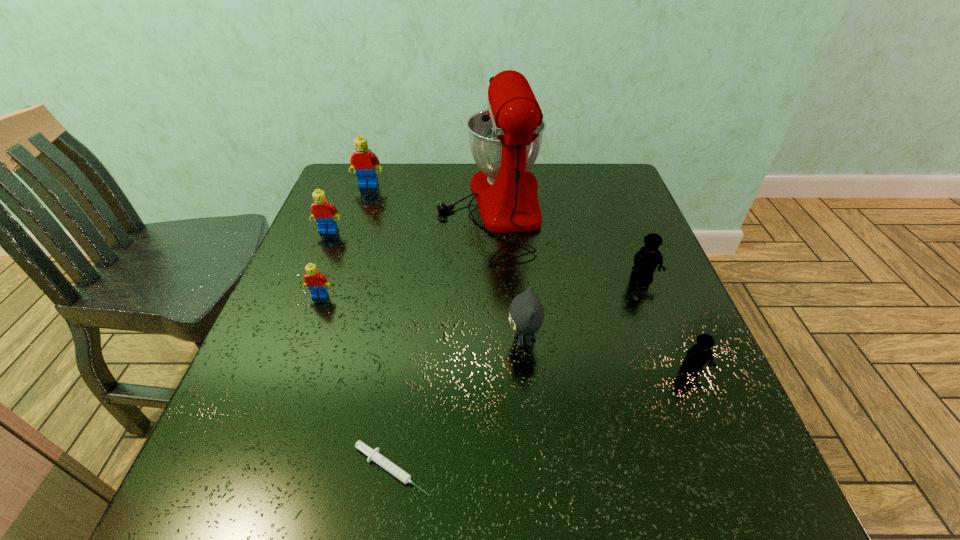
Find the location of `free space between the second biggest red Lego and the fifth nearest object`. free space between the second biggest red Lego and the fifth nearest object is located at coordinates (485, 254).

Locate an element on the screen. The image size is (960, 540). free space that is in between the smaller yellow Lego and the second nearest red Lego is located at coordinates (511, 300).

This screenshot has height=540, width=960. I want to click on vacant space in between the second farthest Lego and the gray kitten, so click(426, 285).

Identify the location of vacant region between the nearer yellow Lego and the biggest red Lego. (530, 277).

Find the location of a particular element. vacant region between the second nearest red Lego and the syringe is located at coordinates (360, 350).

Identify the location of object that ranks as the closest to the syringe. Image resolution: width=960 pixels, height=540 pixels. (526, 313).

Find the location of `object that is the second closest to the smallest red Lego`. object that is the second closest to the smallest red Lego is located at coordinates coord(505,139).

Where is `the second closest Lego to the second smallest red Lego`? The image size is (960, 540). the second closest Lego to the second smallest red Lego is located at coordinates (316, 282).

Choose which Lego is the fourth nearest neighbor to the second farthest red Lego. Please provide its 2D coordinates. Your answer should be formatted as a tuple, i.e. [(x, y)], where the tuple contains the x and y coordinates of a point satisfying the conditions above.

[(700, 353)]

Where is `red Lego object that ranks as the second closest to the fourth farthest Lego`? red Lego object that ranks as the second closest to the fourth farthest Lego is located at coordinates (363, 161).